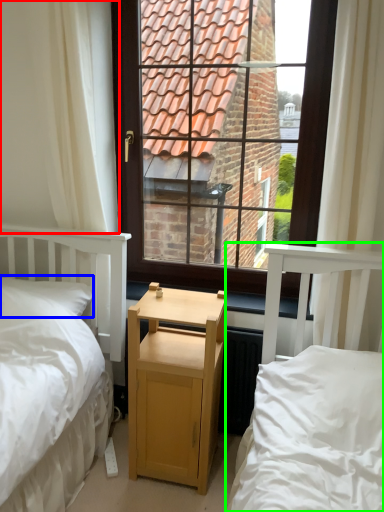
Question: Considering the real-world distances, which object is farthest from curtain (highlighted by a red box)? pillow (highlighted by a blue box) or bed (highlighted by a green box)?

Choices:
 (A) pillow
 (B) bed

Answer: (B)